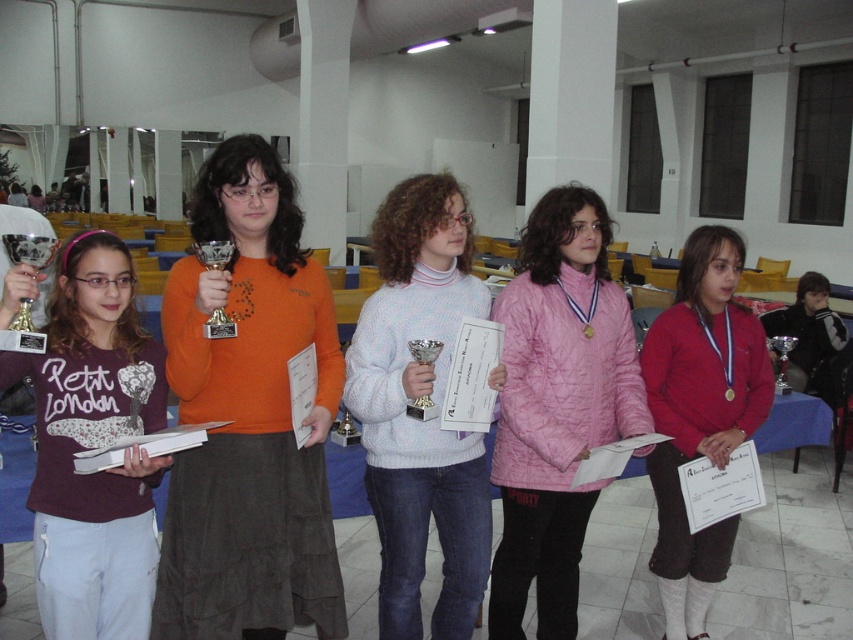
You are a photographer at the awards ceremony. You need to capture a photo that includes both the orange suede skirt at center and the matte red sweater at center. Which one should you position on the left side of the photo to ensure both are visible?

To ensure both the orange suede skirt at center and the matte red sweater at center are visible, position the orange suede skirt at center on the left side since it is already to the left of the matte red sweater at center in the scene.

You are organizing a photo shoot and need to arrange the orange suede skirt at center and the matte purple sweatshirt at left in a display case. The case has a width of 1.2 meters. Based on their sizes, will both items fit side by side?

The orange suede skirt at center might be wider than matte purple sweatshirt at left, but without exact measurements, it is uncertain if both will fit in the 1.2 meters display case. Consider checking the exact widths before finalizing the arrangement.